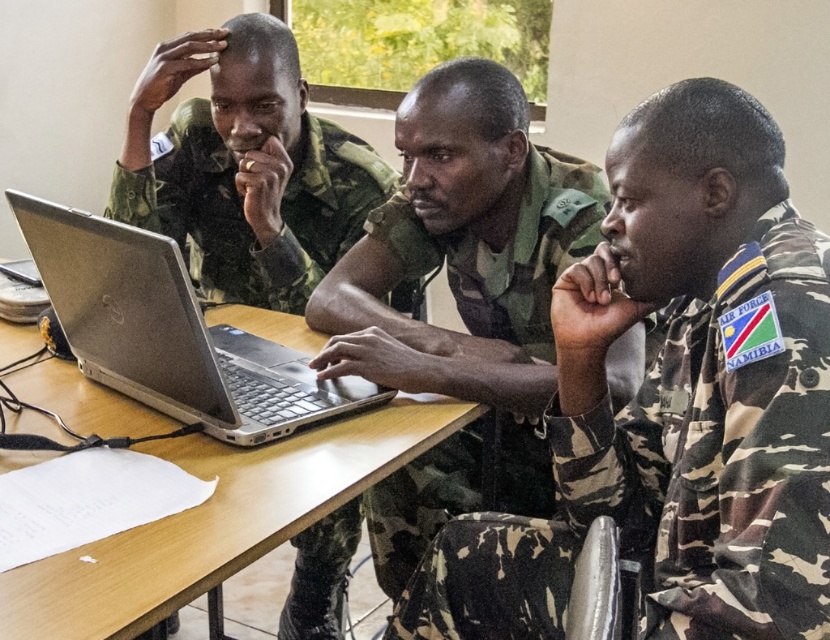
Can you confirm if camouflage fabric uniform at center is taller than silver metallic laptop at center?

Indeed, camouflage fabric uniform at center has a greater height compared to silver metallic laptop at center.

Who is more distant from viewer, (619, 516) or (164, 301)?

Point (619, 516)

You are a GUI agent. You are given a task and a screenshot of the screen. Output one action in this format:
    pyautogui.click(x=<x>, y=<y>)
    Task: Click on the camouflage fabric uniform at center
    This screenshot has width=830, height=640.
    Given the screenshot: What is the action you would take?
    pyautogui.click(x=721, y=449)

Is point (320, 243) positioned behind point (98, 248)?

Yes.

What do you see at coordinates (245, 168) in the screenshot? I see `matte green uniform at upper left` at bounding box center [245, 168].

Where is `matte green uniform at upper left`? This screenshot has height=640, width=830. matte green uniform at upper left is located at coordinates (245, 168).

Is point (750, 493) farther from camera compared to point (545, 316)?

No.

Does camouflage fabric uniform at center have a greater width compared to camouflage uniform at center?

No, camouflage fabric uniform at center is not wider than camouflage uniform at center.

This screenshot has height=640, width=830. I want to click on camouflage fabric uniform at center, so click(x=721, y=449).

You are a GUI agent. You are given a task and a screenshot of the screen. Output one action in this format:
    pyautogui.click(x=<x>, y=<y>)
    Task: Click on the camouflage fabric uniform at center
    
    Given the screenshot: What is the action you would take?
    pyautogui.click(x=721, y=449)